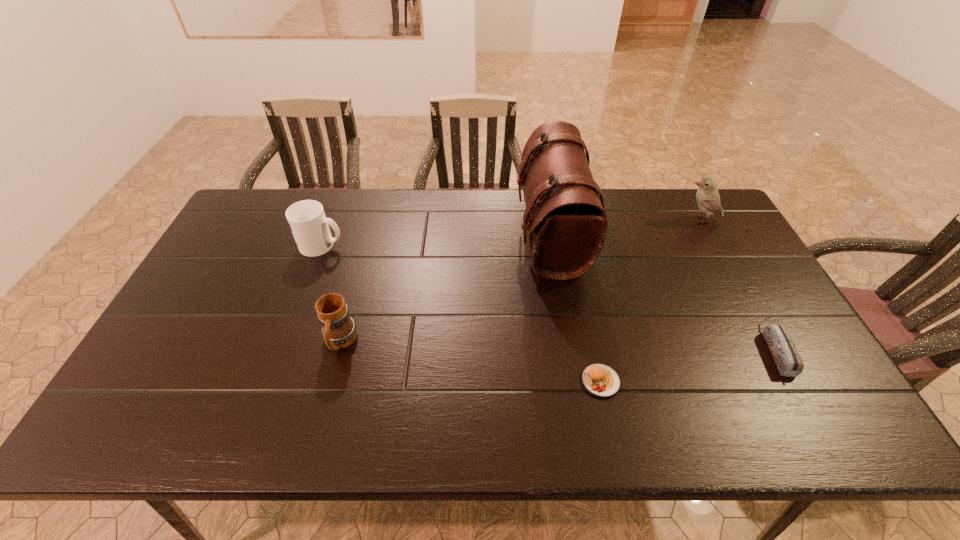
You are a GUI agent. You are given a task and a screenshot of the screen. Output one action in this format:
    pyautogui.click(x=<x>, y=<y>)
    Task: Click on the bird at the right edge
    The image size is (960, 540).
    Given the screenshot: What is the action you would take?
    pyautogui.click(x=708, y=199)

At what (x,y) coordinates should I click in order to perform the action: click on pencil box present at the right edge. Please return your answer as a coordinate pair (x, y). Looking at the image, I should click on (786, 356).

Where is `object that is at the far right corner`? The height and width of the screenshot is (540, 960). object that is at the far right corner is located at coordinates (708, 199).

Identify the location of vacant space at the far edge of the desktop. (365, 221).

Locate an element on the screen. The height and width of the screenshot is (540, 960). vacant position at the near edge of the desktop is located at coordinates (752, 418).

This screenshot has width=960, height=540. What are the coordinates of `vacant space at the left edge of the desktop` in the screenshot? It's located at [248, 261].

The width and height of the screenshot is (960, 540). I want to click on vacant space at the right edge of the desktop, so click(767, 312).

Locate an element on the screen. The image size is (960, 540). vacant area at the far left corner of the desktop is located at coordinates (245, 205).

In order to click on free area in between the pencil box and the patty in this screenshot , I will do `click(688, 365)`.

The height and width of the screenshot is (540, 960). In order to click on free area in between the farther mug and the bird in this screenshot , I will do `click(511, 232)`.